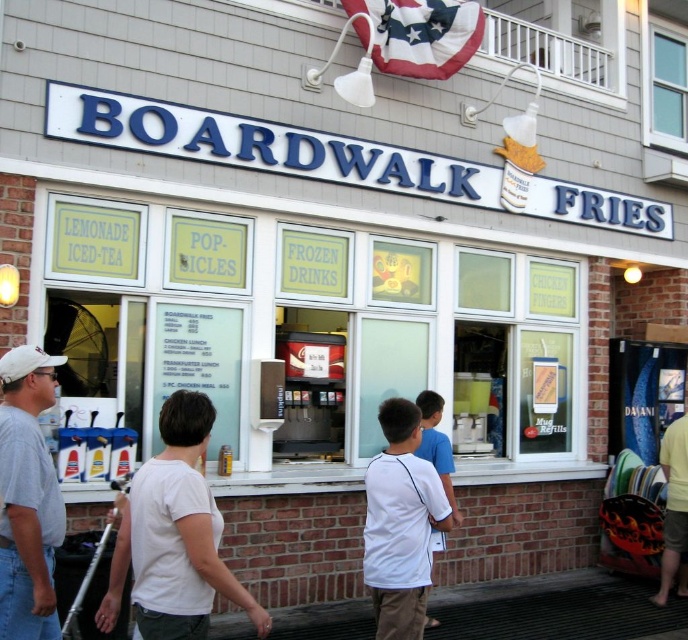
You are a customer at Boardwalk Fries and want to order a drink. You notice two people wearing white shirts at the center of the scene. Which shirt is closer to you, the white matte shirt at center or the white cotton shirt at center?

The white matte shirt at center is closer to you because it is in front of the white cotton shirt at center.